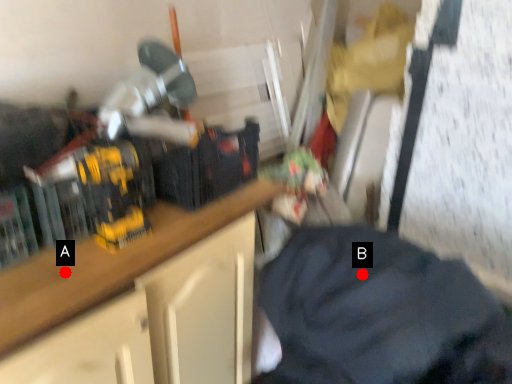
Question: Two points are circled on the image, labeled by A and B beside each circle. Which point is farther from the camera taking this photo?

Choices:
 (A) A is further
 (B) B is further

Answer: (B)